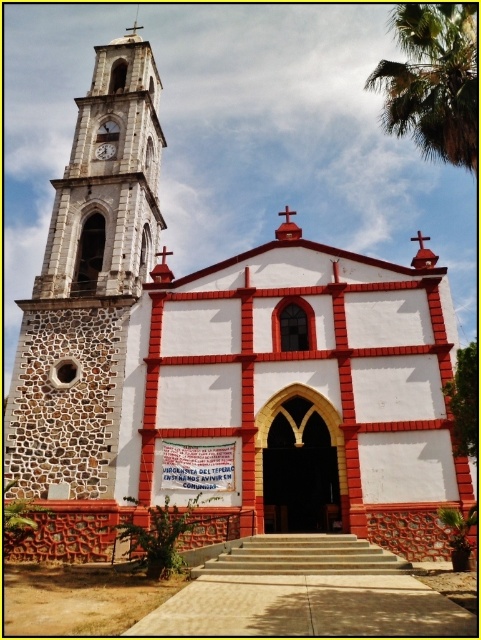
You are standing in front of the church and want to take a photo that includes both the stone clock tower at left and the metallic clock at left. Which object should you position closer to the center of your camera frame to ensure both are fully visible?

The stone clock tower at left is wider than the metallic clock at left, so positioning the stone clock tower at left closer to the center will help ensure both are fully visible in the photo.

You are a tourist visiting the church and want to take a photo that includes both the stone clock tower at left and the green leafy palm tree at upper right. Which object will appear taller in the photo?

The stone clock tower at left is much taller than the green leafy palm tree at upper right, so it will appear taller in the photo.